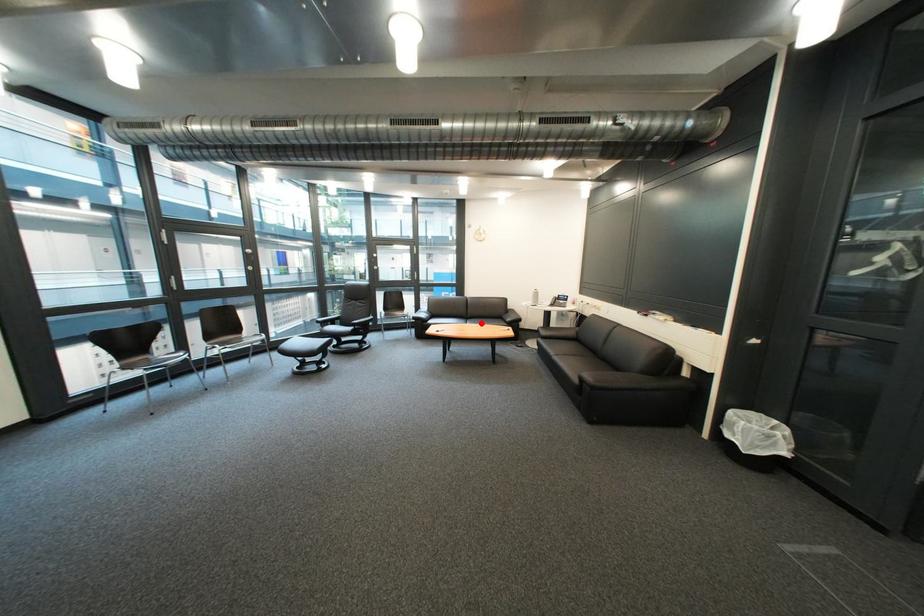
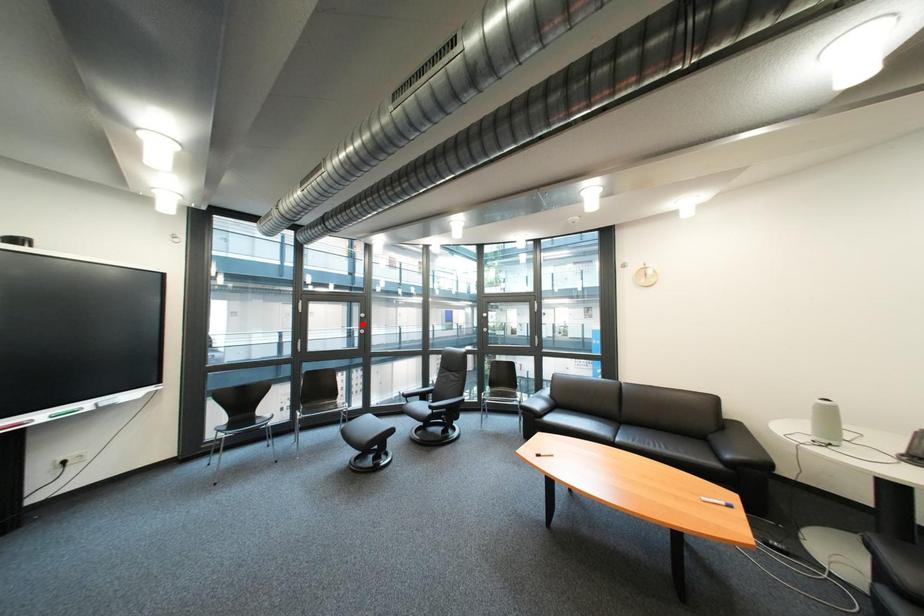
Based on the photo, I am providing you with two images of the same scene from different viewpoints. A red point is marked on the first image and another point is marked on the second image. Is the marked point in image1 the same physical position as the marked point in image2?

No